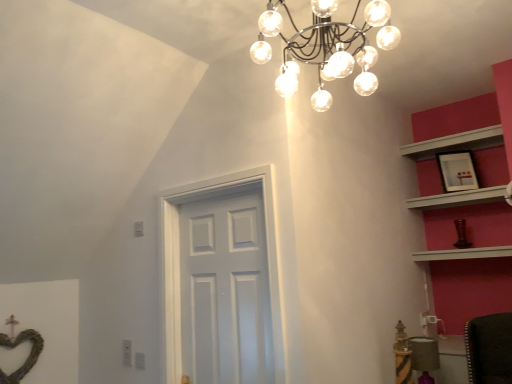
Question: Relative to velvet purple chair at lower right, is matte black picture frame at upper right in front or behind?

Choices:
 (A) behind
 (B) front

Answer: (A)

Question: Does point (465, 172) appear closer or farther from the camera than point (415, 337)?

Choices:
 (A) closer
 (B) farther

Answer: (B)

Question: Estimate the real-world distances between objects in this image. Which object is farther from the white wooden shelf at upper right, the 2th shelf from the bottom?

Choices:
 (A) velvet purple chair at lower right
 (B) white wooden shelf at upper right, positioned as the 1th shelf in bottom-to-top order
 (C) metallic chandelier at upper center
 (D) matte black picture frame at upper right
 (E) white glossy door at center

Answer: (E)

Question: Which is nearer to the matte black picture frame at upper right?

Choices:
 (A) white wooden shelf at upper right, the 2th shelf from the bottom
 (B) velvet purple chair at lower right
 (C) metallic chandelier at upper center
 (D) white glossy door at center
 (E) white wooden shelf at upper right, the second shelf positioned from the top

Answer: (E)